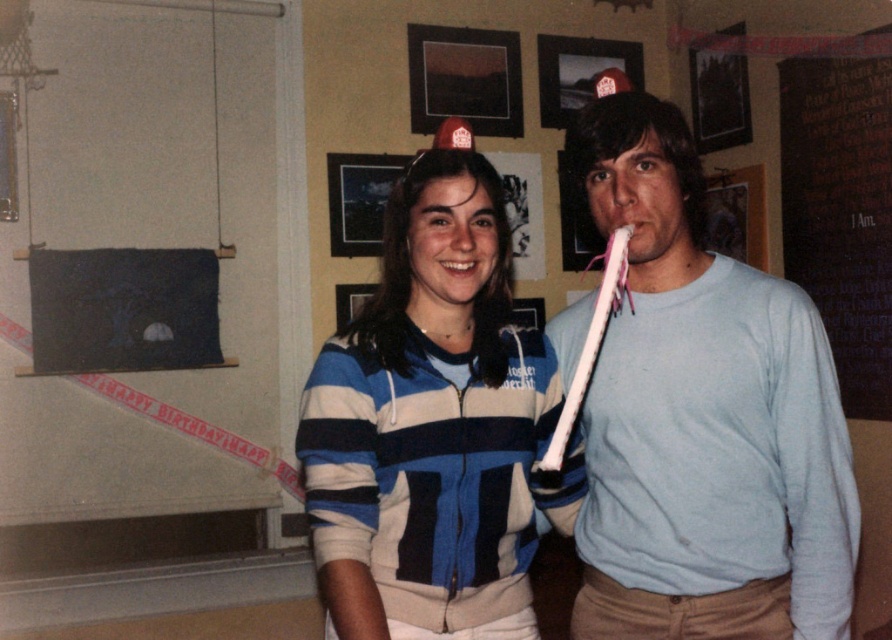
Question: Which point is farther from the camera taking this photo?

Choices:
 (A) (794, 344)
 (B) (450, 148)

Answer: (B)

Question: Which of the following is the farthest from the observer?

Choices:
 (A) light blue cotton shirt at center
 (B) blue striped hoodie at center

Answer: (A)

Question: Which object appears farthest from the camera in this image?

Choices:
 (A) blue striped hoodie at center
 (B) light blue cotton shirt at center

Answer: (B)

Question: Can you confirm if light blue cotton shirt at center is positioned to the right of blue striped hoodie at center?

Choices:
 (A) yes
 (B) no

Answer: (A)

Question: Does light blue cotton shirt at center lie in front of blue striped hoodie at center?

Choices:
 (A) no
 (B) yes

Answer: (A)

Question: Is light blue cotton shirt at center above blue striped hoodie at center?

Choices:
 (A) no
 (B) yes

Answer: (B)